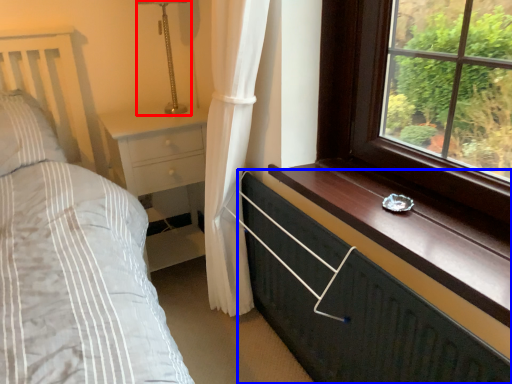
Question: Which of the following is the farthest to the observer, table lamp (highlighted by a red box) or chest of drawers (highlighted by a blue box)?

Choices:
 (A) table lamp
 (B) chest of drawers

Answer: (A)